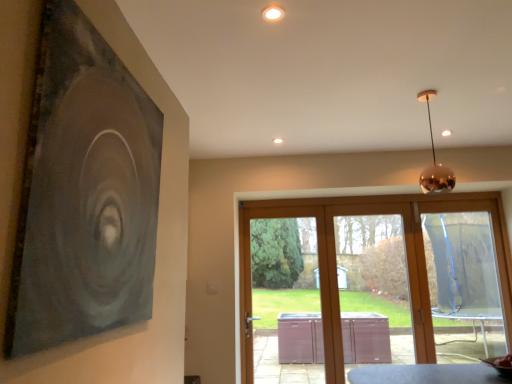
Question: Is the depth of copper metallic sphere at upper right less than that of transparent glass door at center?

Choices:
 (A) no
 (B) yes

Answer: (B)

Question: Does copper metallic sphere at upper right have a greater height compared to transparent glass door at center?

Choices:
 (A) no
 (B) yes

Answer: (A)

Question: From a real-world perspective, is copper metallic sphere at upper right under transparent glass door at center?

Choices:
 (A) no
 (B) yes

Answer: (A)

Question: Does copper metallic sphere at upper right have a lesser height compared to transparent glass door at center?

Choices:
 (A) no
 (B) yes

Answer: (B)

Question: Can you confirm if copper metallic sphere at upper right is thinner than transparent glass door at center?

Choices:
 (A) no
 (B) yes

Answer: (A)

Question: In terms of width, does transparent glass door at center look wider or thinner when compared to transparent plastic screen door at center?

Choices:
 (A) wide
 (B) thin

Answer: (A)

Question: From the image's perspective, relative to transparent plastic screen door at center, is transparent glass door at center above or below?

Choices:
 (A) below
 (B) above

Answer: (A)

Question: Looking at the image, does transparent glass door at center seem bigger or smaller compared to transparent plastic screen door at center?

Choices:
 (A) small
 (B) big

Answer: (B)

Question: From a real-world perspective, is transparent glass door at center positioned above or below transparent plastic screen door at center?

Choices:
 (A) below
 (B) above

Answer: (A)

Question: Is transparent plastic screen at right wider or thinner than transparent glass door at center?

Choices:
 (A) wide
 (B) thin

Answer: (B)

Question: Relative to transparent glass door at center, is transparent plastic screen at right in front or behind?

Choices:
 (A) behind
 (B) front

Answer: (A)

Question: In terms of height, does transparent plastic screen at right look taller or shorter compared to transparent glass door at center?

Choices:
 (A) tall
 (B) short

Answer: (A)

Question: Based on their positions, is transparent plastic screen at right located to the left or right of transparent glass door at center?

Choices:
 (A) right
 (B) left

Answer: (A)

Question: Considering the positions of transparent plastic screen at right and matte black painting at upper left in the image, is transparent plastic screen at right taller or shorter than matte black painting at upper left?

Choices:
 (A) short
 (B) tall

Answer: (B)

Question: Looking at their shapes, would you say transparent plastic screen at right is wider or thinner than matte black painting at upper left?

Choices:
 (A) thin
 (B) wide

Answer: (B)